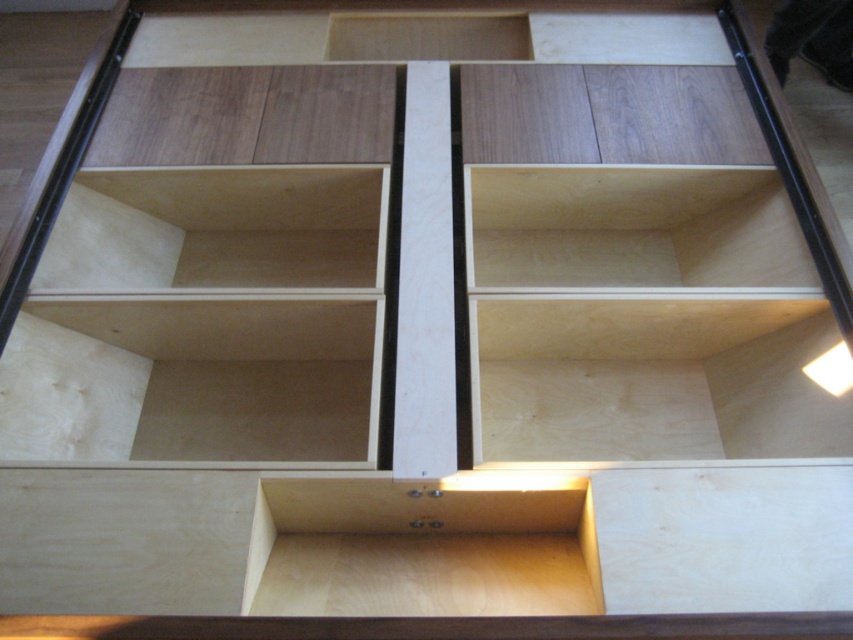
Does light wood/unfinished wood shelf at upper left appear on the left side of natural wood shelf at center-right?

Indeed, light wood/unfinished wood shelf at upper left is positioned on the left side of natural wood shelf at center-right.

In the scene shown: Measure the distance between point (56, 237) and camera.

Point (56, 237) and camera are 1.44 meters apart.

This screenshot has height=640, width=853. Find the location of `light wood/unfinished wood shelf at upper left`. light wood/unfinished wood shelf at upper left is located at coordinates (218, 228).

Find the location of `light wood/unfinished wood shelf at upper left`. light wood/unfinished wood shelf at upper left is located at coordinates (218, 228).